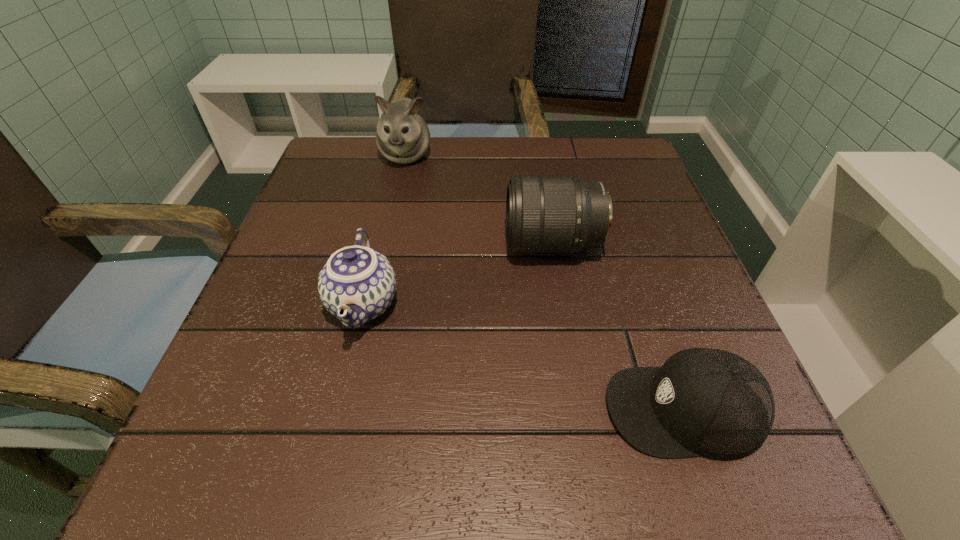
At what (x,y) coordinates should I click in order to perform the action: click on vacant area located on the front-facing side of the cap. Please return your answer as a coordinate pair (x, y). Looking at the image, I should click on (490, 409).

Where is `vacant position located 0.050m on the front-facing side of the cap`? vacant position located 0.050m on the front-facing side of the cap is located at coordinates (570, 409).

Image resolution: width=960 pixels, height=540 pixels. Identify the location of vacant space located on the front-facing side of the cap. (388, 409).

Identify the location of object located in the far edge section of the desktop. (402, 136).

The image size is (960, 540). Find the location of `object positioned at the near edge`. object positioned at the near edge is located at coordinates (707, 402).

Locate an element on the screen. The image size is (960, 540). hamster present at the left edge is located at coordinates (402, 136).

At what (x,y) coordinates should I click in order to perform the action: click on chinaware that is positioned at the left edge. Please return your answer as a coordinate pair (x, y). Image resolution: width=960 pixels, height=540 pixels. Looking at the image, I should click on (357, 284).

Where is `telephoto lens located at the right edge`? The image size is (960, 540). telephoto lens located at the right edge is located at coordinates (544, 214).

Locate an element on the screen. The width and height of the screenshot is (960, 540). cap that is at the right edge is located at coordinates (707, 402).

Image resolution: width=960 pixels, height=540 pixels. In order to click on object that is at the far left corner in this screenshot , I will do `click(402, 136)`.